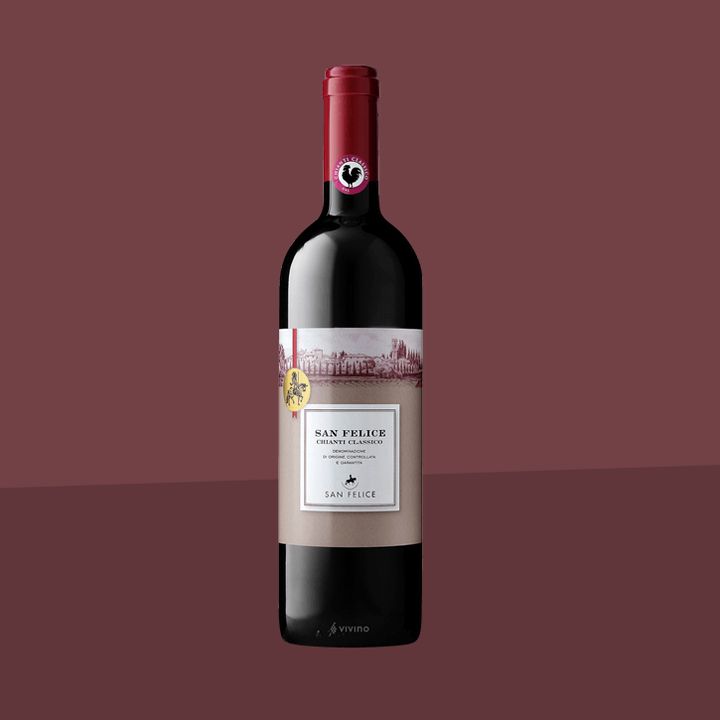
At what (x,y) coordinates should I click in order to perform the action: click on purple table. Please return your answer as a coordinate pair (x, y). Looking at the image, I should click on (522, 638).